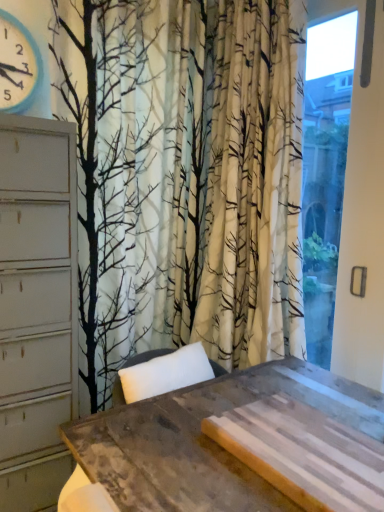
Question: From their relative heights in the image, would you say blue plastic clock at upper left is taller or shorter than transparent glass window at right?

Choices:
 (A) short
 (B) tall

Answer: (A)

Question: Would you say blue plastic clock at upper left is to the left or to the right of transparent glass window at right in the picture?

Choices:
 (A) right
 (B) left

Answer: (B)

Question: Which is nearer to the blue plastic clock at upper left?

Choices:
 (A) rustic wood table at center
 (B) transparent glass window at right

Answer: (B)

Question: Which object is positioned closest to the transparent glass window at right?

Choices:
 (A) blue plastic clock at upper left
 (B) rustic wood table at center

Answer: (B)